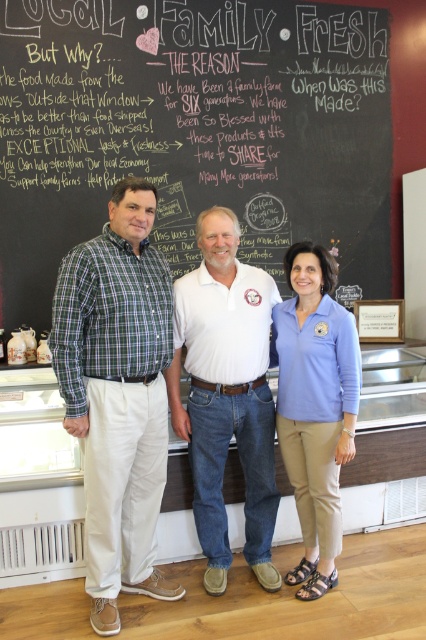
Can you confirm if white cotton shirt at center is positioned to the left of matte blue shirt at center?

Indeed, white cotton shirt at center is positioned on the left side of matte blue shirt at center.

Is white cotton shirt at center below matte blue shirt at center?

No.

In order to click on white cotton shirt at center in this screenshot , I will do `click(227, 394)`.

The width and height of the screenshot is (426, 640). What do you see at coordinates (192, 131) in the screenshot?
I see `chalkboard at center` at bounding box center [192, 131].

Can you confirm if chalkboard at center is thinner than green plaid shirt at left?

No, chalkboard at center is not thinner than green plaid shirt at left.

Is point (72, 100) farther from viewer compared to point (126, 456)?

Yes, point (72, 100) is farther from viewer.

Find the location of a particular element. This screenshot has height=640, width=426. chalkboard at center is located at coordinates (192, 131).

Between chalkboard at center and white cotton shirt at center, which one has less height?

Standing shorter between the two is white cotton shirt at center.

Who is positioned more to the right, chalkboard at center or white cotton shirt at center?

white cotton shirt at center is more to the right.

This screenshot has height=640, width=426. What do you see at coordinates (192, 131) in the screenshot? I see `chalkboard at center` at bounding box center [192, 131].

This screenshot has height=640, width=426. I want to click on chalkboard at center, so click(192, 131).